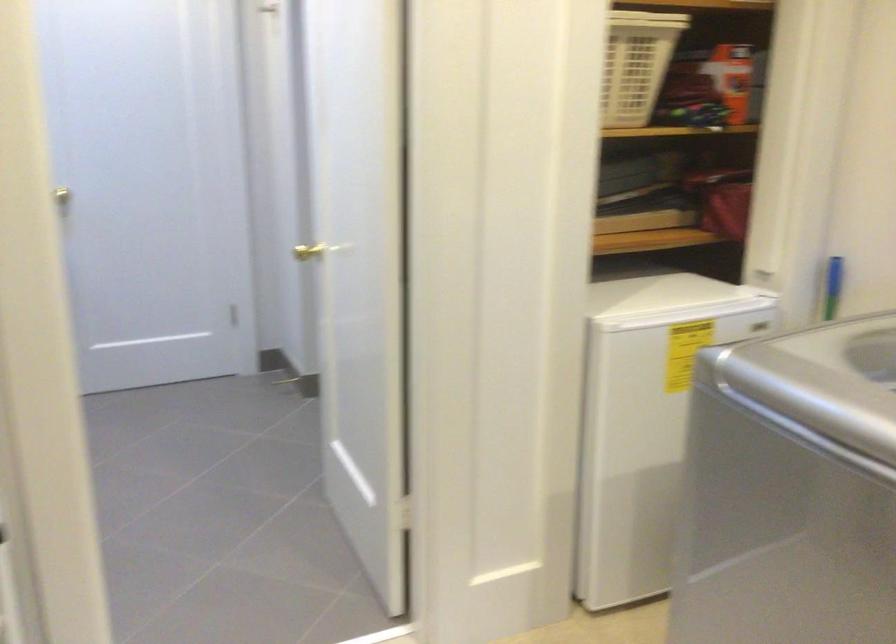
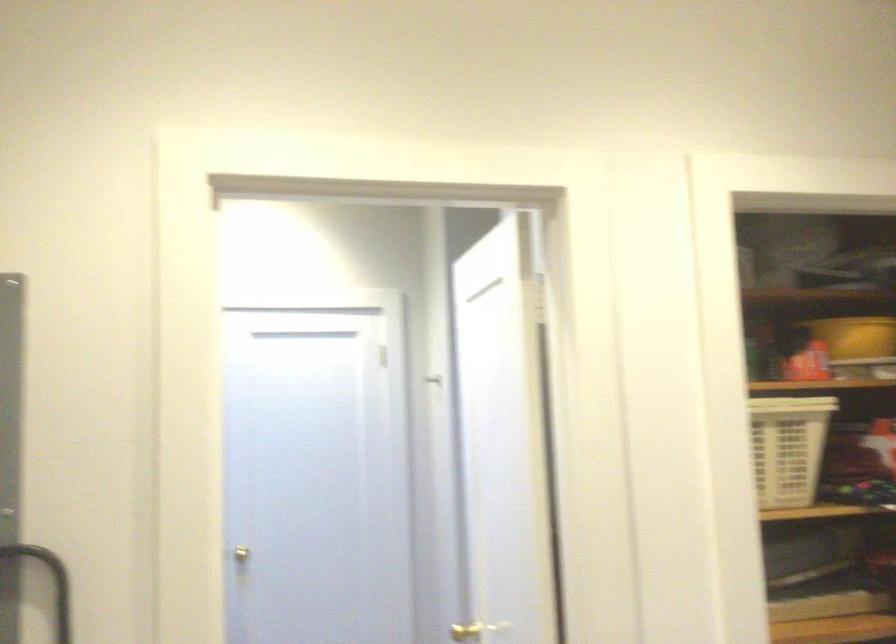
In a continuous first-person perspective shot, in which direction is the camera moving?

The cameraman moved toward right, backward.